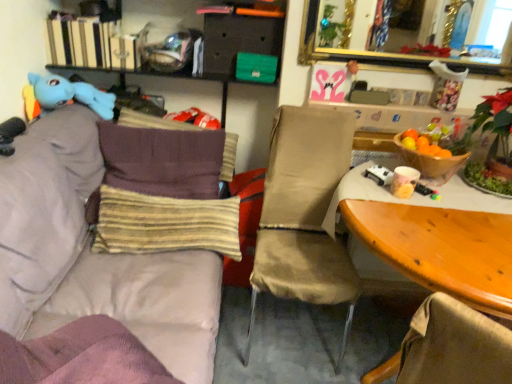
Question: Which direction should I rotate to look at yellow striped fabric pillow at center, arranged as the second pillow when viewed from the back?

Choices:
 (A) left
 (B) right

Answer: (A)

Question: From the image's perspective, is beige fabric chair at center on wooden table at right?

Choices:
 (A) yes
 (B) no

Answer: (A)

Question: Is beige fabric chair at center thinner than wooden table at right?

Choices:
 (A) no
 (B) yes

Answer: (A)

Question: Would you say wooden table at right is part of beige fabric chair at center's contents?

Choices:
 (A) yes
 (B) no

Answer: (B)

Question: Is beige fabric chair at center to the right of wooden table at right from the viewer's perspective?

Choices:
 (A) no
 (B) yes

Answer: (A)

Question: Could you tell me if beige fabric chair at center is facing wooden table at right?

Choices:
 (A) yes
 (B) no

Answer: (B)

Question: Is beige fabric chair at center taller than wooden table at right?

Choices:
 (A) no
 (B) yes

Answer: (A)

Question: From the image's perspective, is light purple fabric couch at left above wooden table at right?

Choices:
 (A) no
 (B) yes

Answer: (B)

Question: Is light purple fabric couch at left smaller than wooden table at right?

Choices:
 (A) yes
 (B) no

Answer: (B)

Question: Is light purple fabric couch at left further to camera compared to wooden table at right?

Choices:
 (A) yes
 (B) no

Answer: (B)

Question: Is light purple fabric couch at left oriented away from wooden table at right?

Choices:
 (A) yes
 (B) no

Answer: (B)

Question: Is light purple fabric couch at left thinner than wooden table at right?

Choices:
 (A) no
 (B) yes

Answer: (A)

Question: From the image's perspective, would you say light purple fabric couch at left is shown under wooden table at right?

Choices:
 (A) yes
 (B) no

Answer: (B)

Question: Is matte black drawer at upper center looking in the opposite direction of beige fabric chair at center?

Choices:
 (A) no
 (B) yes

Answer: (A)